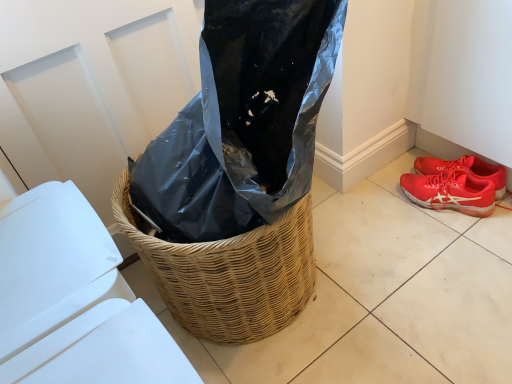
Question: Is shiny red sneakers at lower right, acting as the 2th footwear starting from the top, taller than red mesh shoe at lower right, which is the 1th footwear in top-to-bottom order?

Choices:
 (A) yes
 (B) no

Answer: (B)

Question: Is shiny red sneakers at lower right, acting as the 2th footwear starting from the top, positioned behind red mesh shoe at lower right, the 2th footwear positioned from the bottom?

Choices:
 (A) yes
 (B) no

Answer: (B)

Question: Considering the relative sizes of shiny red sneakers at lower right, acting as the 2th footwear starting from the top, and red mesh shoe at lower right, the 2th footwear positioned from the bottom, in the image provided, is shiny red sneakers at lower right, acting as the 2th footwear starting from the top, wider than red mesh shoe at lower right, the 2th footwear positioned from the bottom,?

Choices:
 (A) yes
 (B) no

Answer: (A)

Question: Is shiny red sneakers at lower right, acting as the 2th footwear starting from the top, thinner than red mesh shoe at lower right, which is the 1th footwear in top-to-bottom order?

Choices:
 (A) no
 (B) yes

Answer: (A)

Question: Does shiny red sneakers at lower right, which is the first footwear in bottom-to-top order, turn towards red mesh shoe at lower right, the 2th footwear positioned from the bottom?

Choices:
 (A) no
 (B) yes

Answer: (B)

Question: Considering their positions, is white plastic lid at lower left located in front of or behind shiny red sneakers at lower right, which is the first footwear in bottom-to-top order?

Choices:
 (A) behind
 (B) front

Answer: (B)

Question: From a real-world perspective, is white plastic lid at lower left above or below shiny red sneakers at lower right, which is the first footwear in bottom-to-top order?

Choices:
 (A) below
 (B) above

Answer: (B)

Question: From the image's perspective, is white plastic lid at lower left above or below shiny red sneakers at lower right, which is the first footwear in bottom-to-top order?

Choices:
 (A) below
 (B) above

Answer: (A)

Question: From their relative heights in the image, would you say white plastic lid at lower left is taller or shorter than shiny red sneakers at lower right, which is the first footwear in bottom-to-top order?

Choices:
 (A) short
 (B) tall

Answer: (B)

Question: Considering the relative positions of shiny red sneakers at lower right, which is the first footwear in bottom-to-top order, and white plastic lid at lower left in the image provided, is shiny red sneakers at lower right, which is the first footwear in bottom-to-top order, to the left or to the right of white plastic lid at lower left?

Choices:
 (A) left
 (B) right

Answer: (B)

Question: Considering their positions, is shiny red sneakers at lower right, which is the first footwear in bottom-to-top order, located in front of or behind white plastic lid at lower left?

Choices:
 (A) front
 (B) behind

Answer: (B)

Question: Is shiny red sneakers at lower right, which is the first footwear in bottom-to-top order, inside the boundaries of white plastic lid at lower left, or outside?

Choices:
 (A) outside
 (B) inside

Answer: (A)

Question: Considering the positions of shiny red sneakers at lower right, which is the first footwear in bottom-to-top order, and white plastic lid at lower left in the image, is shiny red sneakers at lower right, which is the first footwear in bottom-to-top order, wider or thinner than white plastic lid at lower left?

Choices:
 (A) thin
 (B) wide

Answer: (A)

Question: From the image's perspective, is shiny red sneakers at lower right, which is the first footwear in bottom-to-top order, positioned above or below red mesh shoe at lower right, the 2th footwear positioned from the bottom?

Choices:
 (A) above
 (B) below

Answer: (B)

Question: In terms of size, does shiny red sneakers at lower right, which is the first footwear in bottom-to-top order, appear bigger or smaller than red mesh shoe at lower right, the 2th footwear positioned from the bottom?

Choices:
 (A) big
 (B) small

Answer: (A)